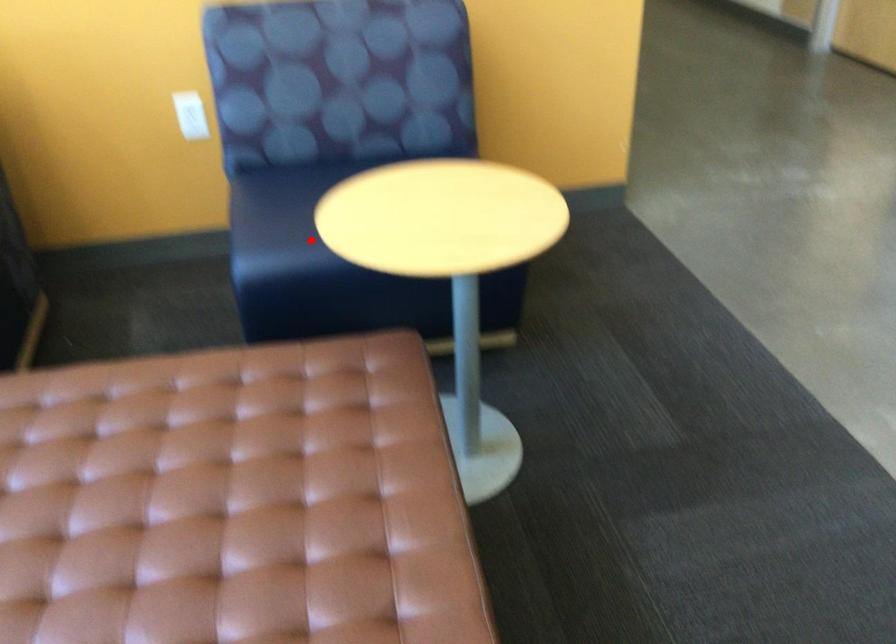
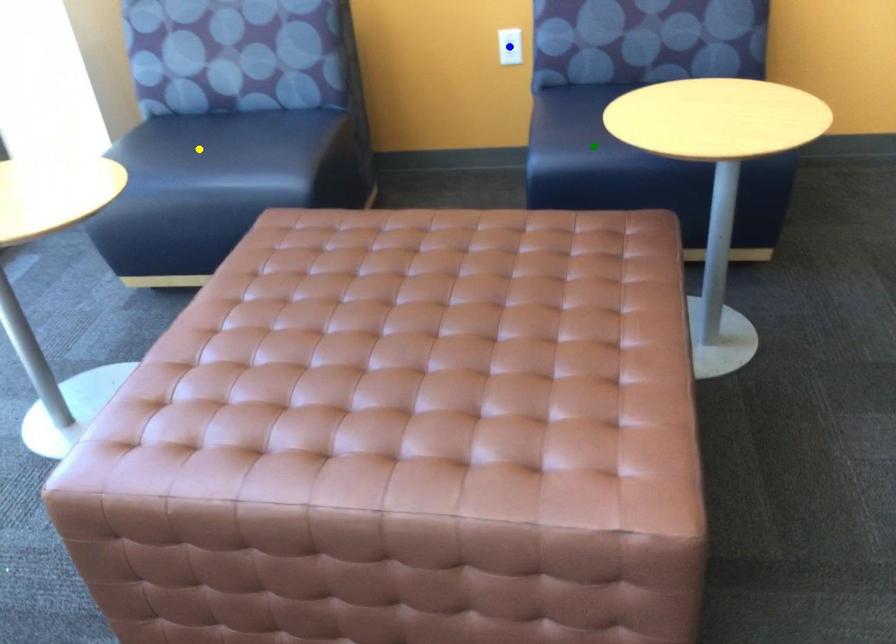
Question: I am providing you with two images of the same scene from different viewpoints. A red point is marked on the first image. You are given multiple points on the second image. Which mark in image 2 goes with the point in image 1?

Choices:
 (A) blue point
 (B) green point
 (C) yellow point

Answer: (B)